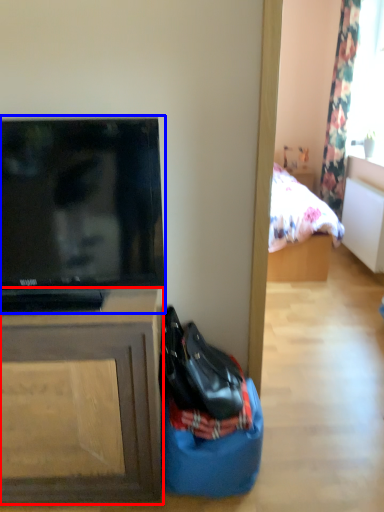
Question: Which object is further to the camera taking this photo, cabinetry (highlighted by a red box) or television (highlighted by a blue box)?

Choices:
 (A) cabinetry
 (B) television

Answer: (A)